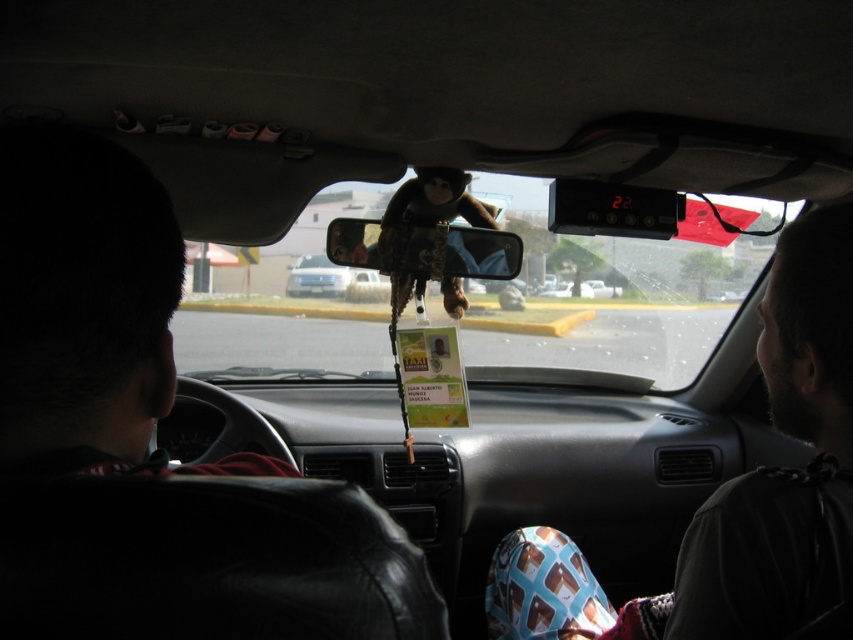
The height and width of the screenshot is (640, 853). I want to click on bearded man at right, so click(734, 492).

How much distance is there between bearded man at right and silver metallic car at center?

They are 1.96 meters apart.

Is point (762, 588) positioned behind point (323, 296)?

No.

Find the location of a particular element. The width and height of the screenshot is (853, 640). bearded man at right is located at coordinates (734, 492).

Can you confirm if matte plastic view mirror at center is positioned to the left of silver metallic car at center?

Incorrect, matte plastic view mirror at center is not on the left side of silver metallic car at center.

Who is more distant from viewer, (329, 257) or (289, 268)?

The point (289, 268) is more distant.

Does point (451, 241) lie behind point (288, 273)?

No.

Where is `matte plastic view mirror at center`? This screenshot has height=640, width=853. matte plastic view mirror at center is located at coordinates (424, 248).

Consider the image. Can you confirm if bearded man at right is positioned below fuzzy fabric monkey at center?

Correct, bearded man at right is located below fuzzy fabric monkey at center.

Which is above, bearded man at right or fuzzy fabric monkey at center?

fuzzy fabric monkey at center is above.

Is point (772, 392) positioned behind point (461, 173)?

That is False.

Locate an element on the screen. The image size is (853, 640). bearded man at right is located at coordinates (734, 492).